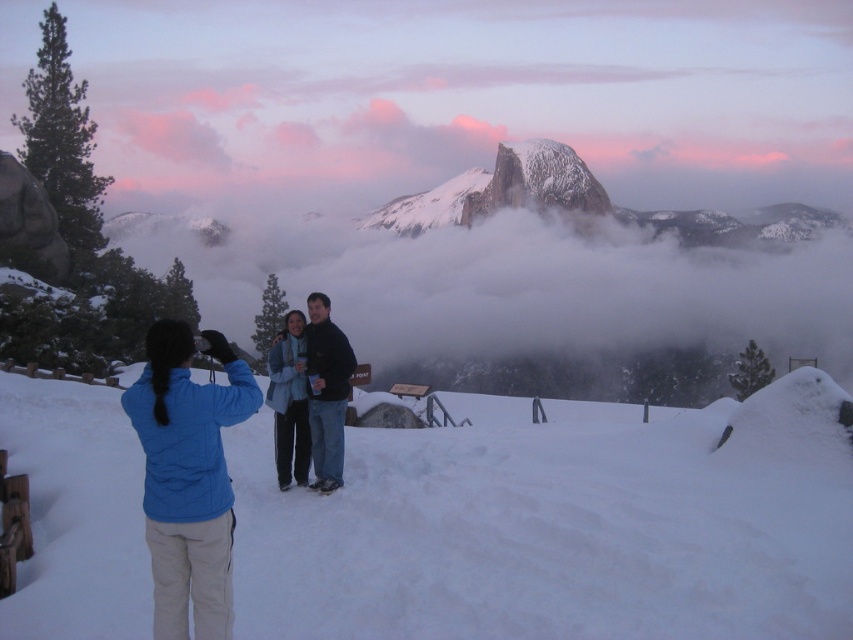
You are a photographer standing at the winter scene. You want to capture a photo that includes both the white snow at lower left and the snowy granite peak at center. Which object should you position closer to the left side of your camera frame?

The white snow at lower left should be positioned closer to the left side of your camera frame since it is already on the left side of the snowy granite peak at center in the scene.

You are standing at the viewpoint and want to reach the point marked as point [138,436]. If your walking speed is 1.5 meters per second, how long will it take you to reach that point?

The distance between you and point [138,436] is 49.68 meters. At a speed of 1.5 meters per second, it will take approximately 33.12 seconds to reach the point.

You are standing at the point labeled point (113, 440) and want to walk to the point labeled point (582, 161). Given that both points are on the same path, which direction should you face to move towards the second point?

Since point (113, 440) is closer to the viewer than point (582, 161), you should face away from the viewer to move towards the second point.